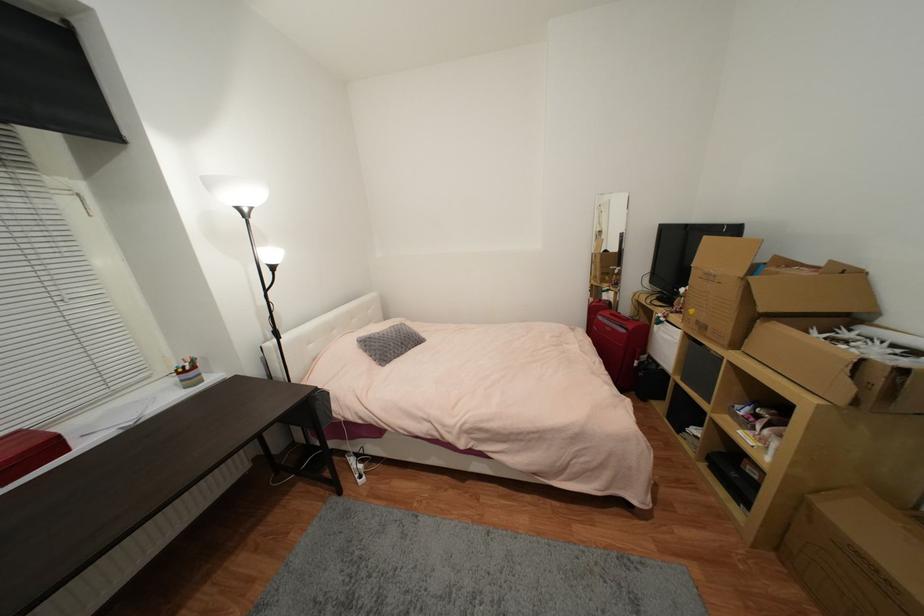
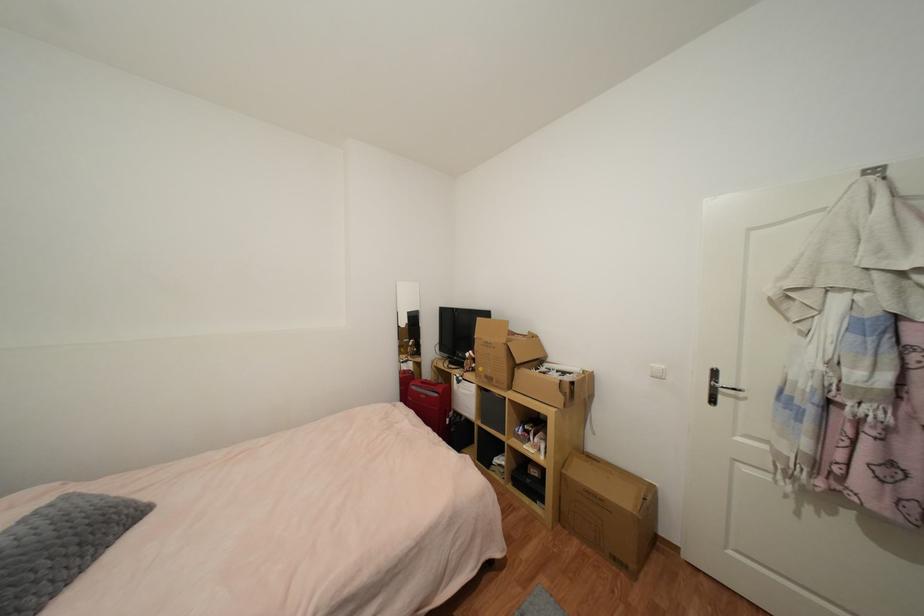
The point at (x=627, y=331) is marked in the first image. Where is the corresponding point in the second image?

(440, 397)